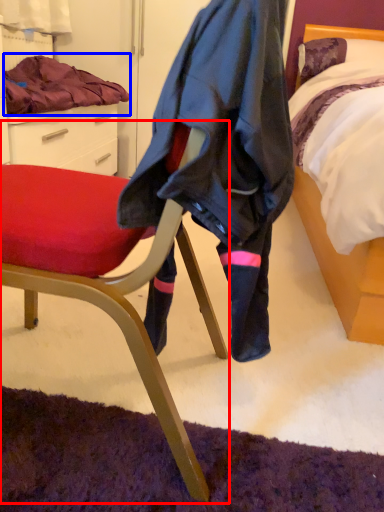
Question: Which of the following is the closest to the observer, chair (highlighted by a red box) or blanket (highlighted by a blue box)?

Choices:
 (A) chair
 (B) blanket

Answer: (A)